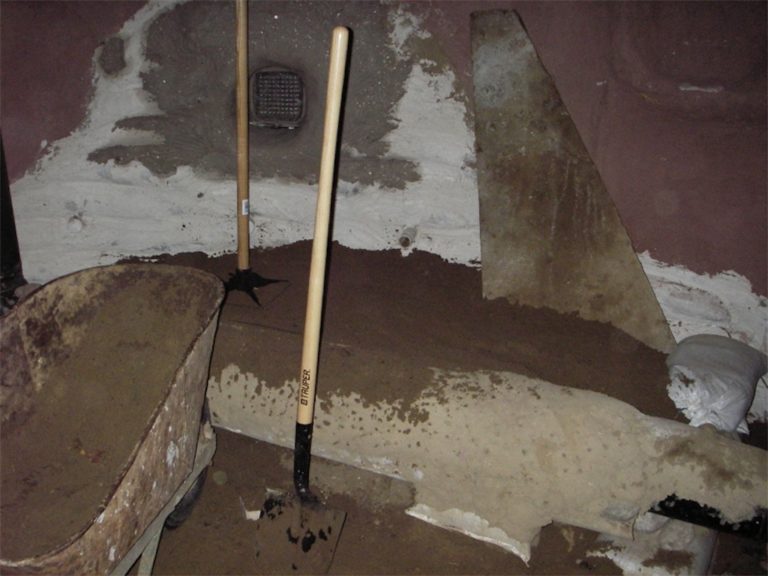
The image size is (768, 576). What are the coordinates of `sticker` in the screenshot? It's located at (245, 208).